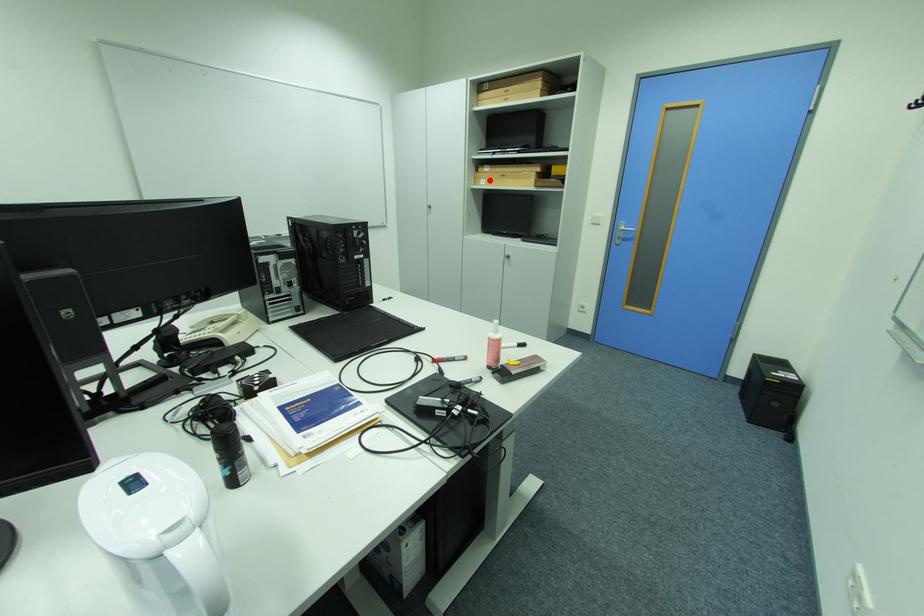
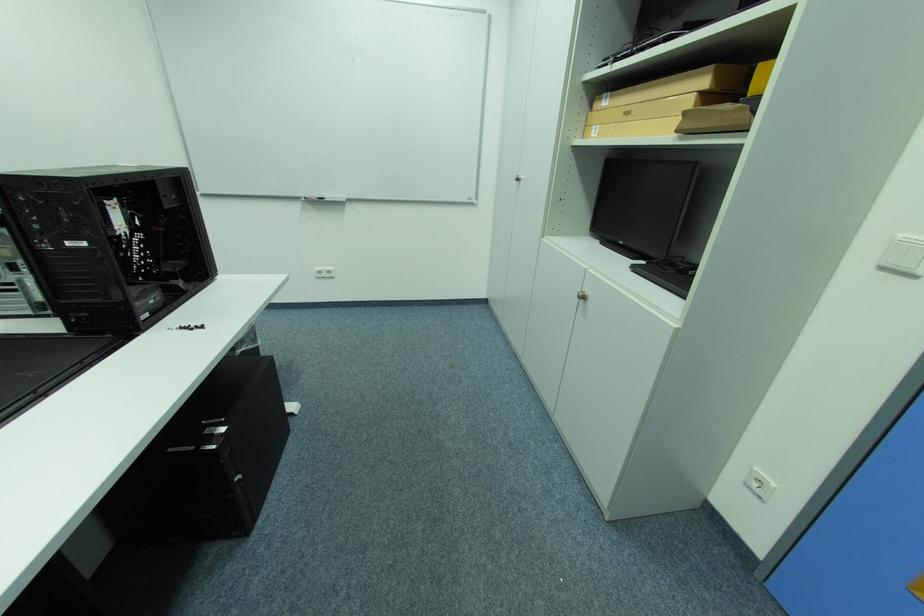
Question: A red point is marked in image1. In image2, is the corresponding 3D point closer to the camera or farther? Reply with the corresponding letter.

Choices:
 (A) The corresponding 3D point is closer.
 (B) The corresponding 3D point is farther.

Answer: (B)